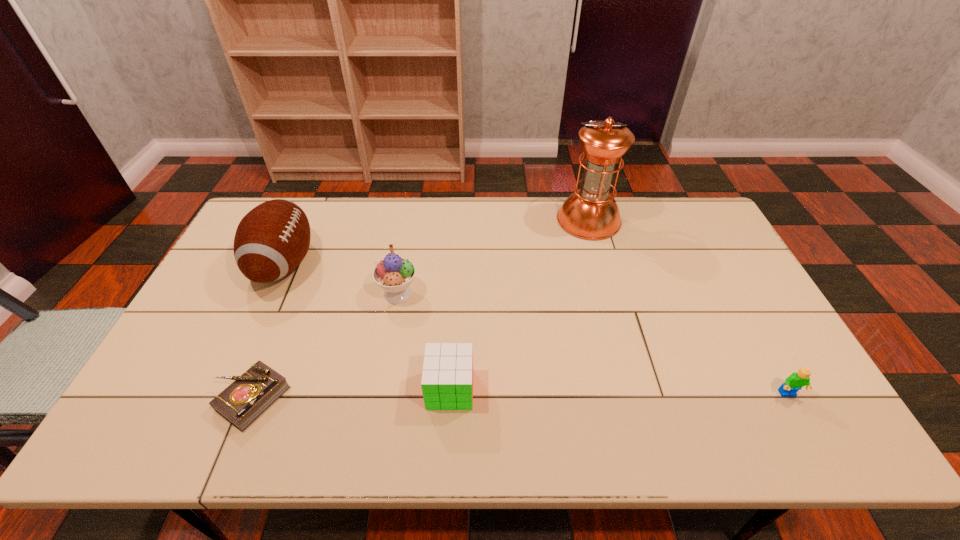
At what (x,y) coordinates should I click in order to perform the action: click on empty space that is in between the football and the third tallest object. Please return your answer as a coordinate pair (x, y). The width and height of the screenshot is (960, 540). Looking at the image, I should click on click(341, 279).

Locate an element on the screen. empty space between the tallest object and the football is located at coordinates (436, 242).

The width and height of the screenshot is (960, 540). Find the location of `vacant region between the rightmost object and the icecream`. vacant region between the rightmost object and the icecream is located at coordinates (593, 344).

At what (x,y) coordinates should I click in order to perform the action: click on vacant space in between the third object from left to right and the shortest object. Please return your answer as a coordinate pair (x, y). Looking at the image, I should click on (324, 346).

Locate an element on the screen. object that is the closest to the cube is located at coordinates (394, 274).

Identify which object is the third nearest to the fifth shortest object. Please provide its 2D coordinates. Your answer should be formatted as a tuple, i.e. [(x, y)], where the tuple contains the x and y coordinates of a point satisfying the conditions above.

[(447, 378)]

The height and width of the screenshot is (540, 960). In order to click on vacant space that satisfies the following two spatial constraints: 1. on the back side of the cube; 2. on the laces of the football in this screenshot , I will do `click(457, 264)`.

Identify the location of vacant space that satisfies the following two spatial constraints: 1. on the laces of the football; 2. on the right side of the diary. (223, 398).

The height and width of the screenshot is (540, 960). I want to click on free space in the image that satisfies the following two spatial constraints: 1. on the laces of the icecream; 2. on the right side of the fifth shortest object, so click(271, 293).

Where is `free space that satisfies the following two spatial constraints: 1. on the front side of the oil lamp; 2. on the laces of the football`? free space that satisfies the following two spatial constraints: 1. on the front side of the oil lamp; 2. on the laces of the football is located at coordinates (601, 264).